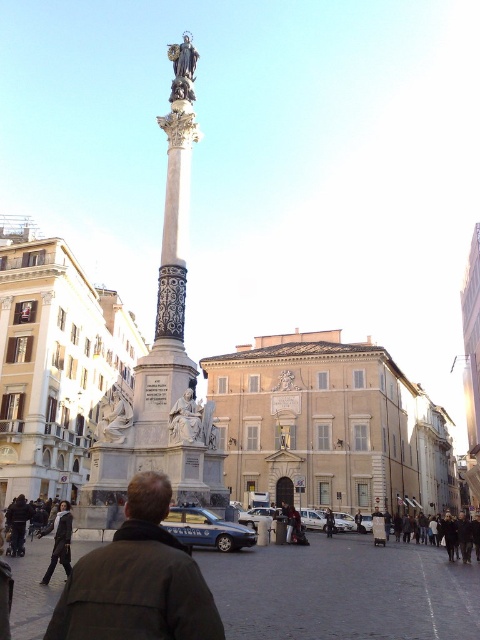
Can you confirm if polished bronze statue at upper center is positioned above white marble statue at lower left?

Yes.

Does polished bronze statue at upper center have a larger size compared to white marble statue at lower left?

No, polished bronze statue at upper center is not bigger than white marble statue at lower left.

The width and height of the screenshot is (480, 640). Identify the location of polished bronze statue at upper center. (182, 68).

Identify the location of polished bronze statue at upper center. The image size is (480, 640). (182, 68).

Does white marble column at center appear under black leather jacket at lower center?

Actually, white marble column at center is above black leather jacket at lower center.

Is white marble column at center wider than black leather jacket at lower center?

Yes, white marble column at center is wider than black leather jacket at lower center.

Which is in front, point (158, 307) or point (330, 531)?

Point (158, 307)

Where is `white marble column at center`? This screenshot has height=640, width=480. white marble column at center is located at coordinates (164, 360).

Between white marble column at center and white marble statue at center, which one has less height?

white marble statue at center is shorter.

Does point (165, 212) lie in front of point (172, 404)?

No.

Which is in front, point (164, 353) or point (180, 401)?

Point (180, 401) is in front.

This screenshot has width=480, height=640. In order to click on white marble column at center in this screenshot , I will do `click(164, 360)`.